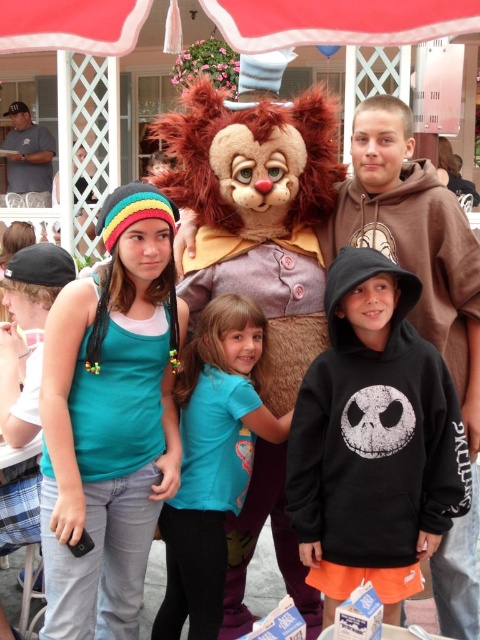
Question: Among these objects, which one is nearest to the camera?

Choices:
 (A) red fabric canopy at upper center
 (B) teal t-shirt at center
 (C) teal fabric tank top at left
 (D) furry brown costume at center

Answer: (A)

Question: Where is teal t-shirt at center located in relation to red fabric canopy at upper center in the image?

Choices:
 (A) left
 (B) right

Answer: (A)

Question: Is teal t-shirt at center thinner than red fabric canopy at upper center?

Choices:
 (A) no
 (B) yes

Answer: (B)

Question: Is teal fabric tank top at left in front of red fabric canopy at upper center?

Choices:
 (A) yes
 (B) no

Answer: (B)

Question: Which point appears closest to the camera in this image?

Choices:
 (A) (287, 492)
 (B) (256, 310)
 (C) (420, 12)
 (D) (118, 403)

Answer: (C)

Question: Which object is farther from the camera taking this photo?

Choices:
 (A) teal fabric tank top at left
 (B) teal t-shirt at center
 (C) red fabric canopy at upper center
 (D) furry brown costume at center

Answer: (D)